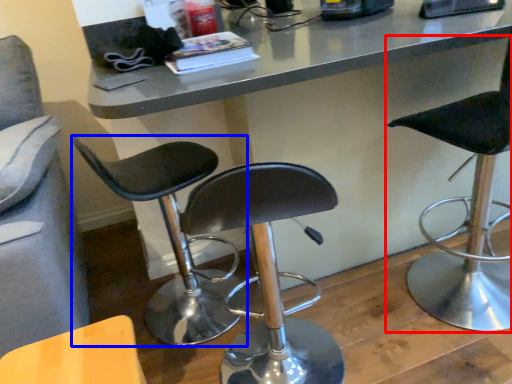
Question: Among these objects, which one is nearest to the camera, chair (highlighted by a red box) or chair (highlighted by a blue box)?

Choices:
 (A) chair
 (B) chair

Answer: (A)